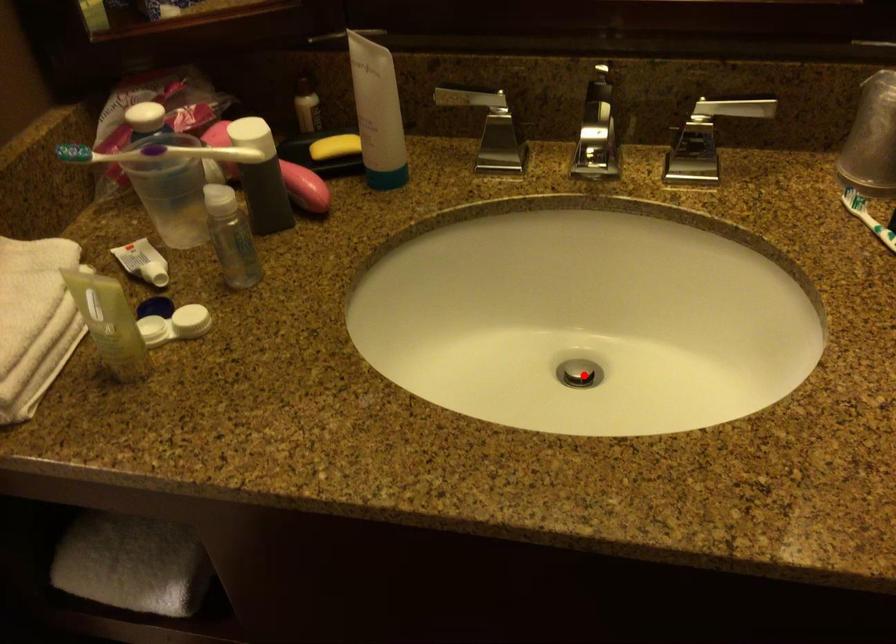
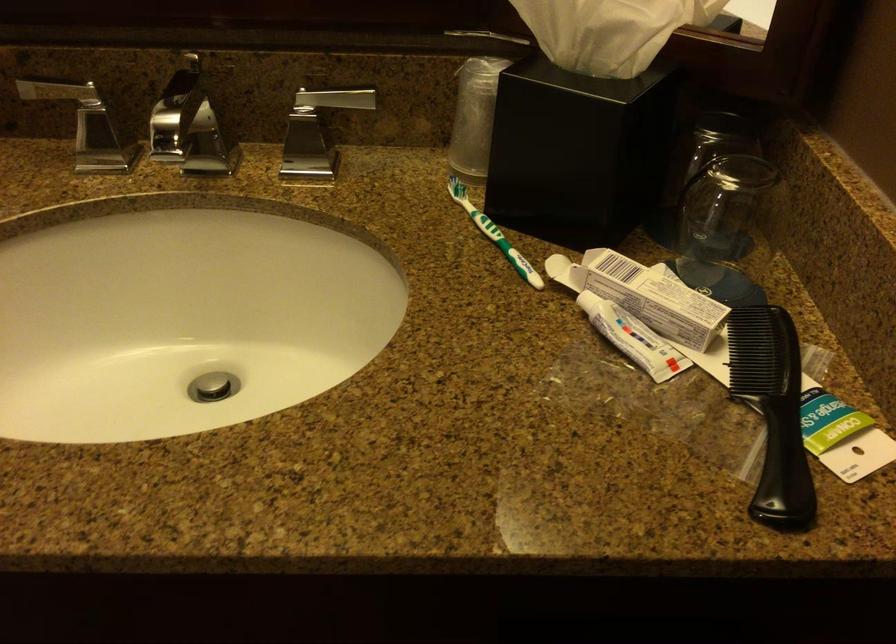
The point at the highlighted location is marked in the first image. Where is the corresponding point in the second image?

(212, 386)